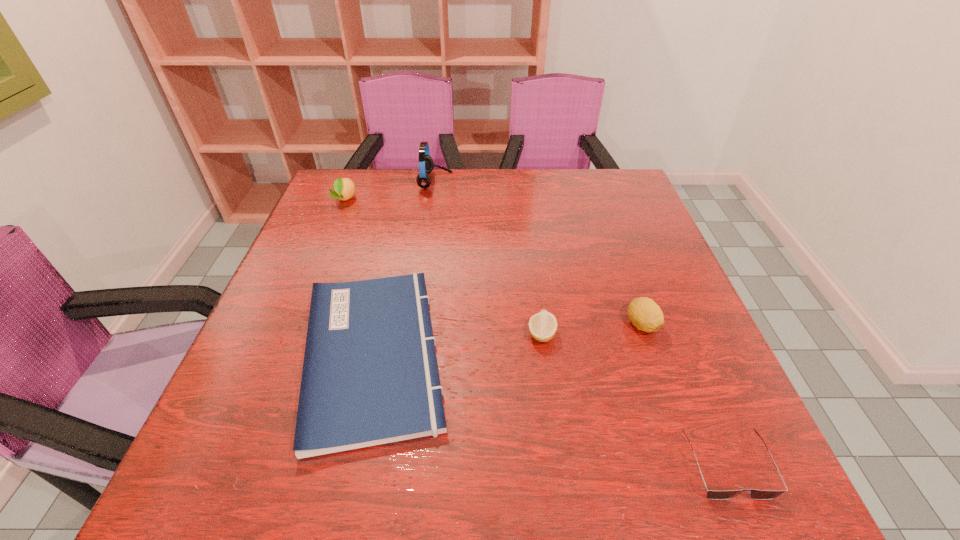
The width and height of the screenshot is (960, 540). In order to click on empty space that is in between the second lemon from right to left and the sunglasses in this screenshot , I will do `click(634, 400)`.

Where is `free space between the second lemon from left to right and the sunglasses`? The width and height of the screenshot is (960, 540). free space between the second lemon from left to right and the sunglasses is located at coordinates (634, 400).

What are the coordinates of `free spot between the sunglasses and the second lemon from left to right` in the screenshot? It's located at pyautogui.click(x=634, y=400).

Locate an element on the screen. vacant region between the leftmost lemon and the third object from right to left is located at coordinates pyautogui.click(x=444, y=266).

Find the location of a particular element. The height and width of the screenshot is (540, 960). free spot between the rightmost lemon and the headset is located at coordinates (539, 253).

This screenshot has width=960, height=540. What are the coordinates of `free space between the leftmost lemon and the tallest object` in the screenshot? It's located at (390, 190).

You are a GUI agent. You are given a task and a screenshot of the screen. Output one action in this format:
    pyautogui.click(x=<x>, y=<y>)
    Task: Click on the free area in between the tallest object and the rightmost lemon
    The height and width of the screenshot is (540, 960).
    Given the screenshot: What is the action you would take?
    pyautogui.click(x=539, y=253)

Locate an element on the screen. The width and height of the screenshot is (960, 540). free space between the second lemon from right to left and the leftmost lemon is located at coordinates point(444,266).

This screenshot has height=540, width=960. In order to click on object that ranks as the closest to the shortest lemon in this screenshot , I will do `click(644, 313)`.

Locate an element on the screen. The height and width of the screenshot is (540, 960). object that is the third closest to the farthest lemon is located at coordinates (543, 325).